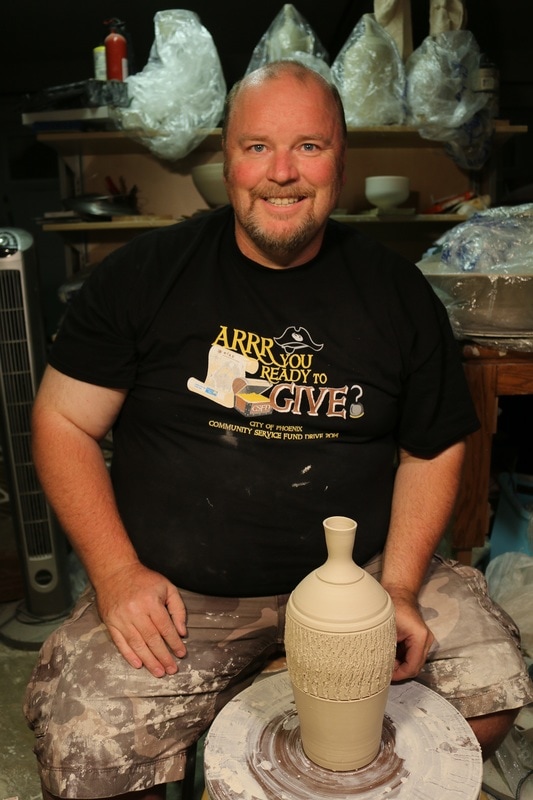
Find the location of a particular element. sections of heater coils is located at coordinates (10, 288), (10, 328), (16, 354), (16, 385), (16, 409), (18, 454), (22, 478), (29, 513), (34, 538).